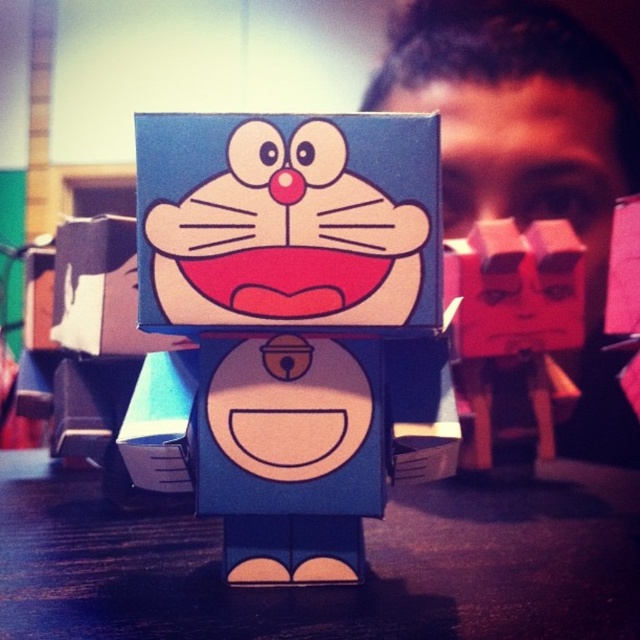
Who is more distant from viewer, (x=545, y=4) or (x=509, y=172)?

Point (x=545, y=4)

Is matte plastic man at center shorter than matte pink cube at center?

No.

This screenshot has height=640, width=640. Identify the location of matte plastic man at center. (529, 156).

Does blue cardboard table at center have a lesser height compared to matte pink cube at right?

Yes, blue cardboard table at center is shorter than matte pink cube at right.

Is blue cardboard table at center smaller than matte pink cube at right?

No.

Find the location of a particular element. blue cardboard table at center is located at coordinates (330, 586).

Who is positioned more to the right, blue cardboard table at center or matte pink cube at center?

Positioned to the right is matte pink cube at center.

Can you confirm if blue cardboard table at center is positioned to the right of matte pink cube at center?

No, blue cardboard table at center is not to the right of matte pink cube at center.

Is point (168, 552) in front of point (538, 118)?

Yes, it is.

Find the location of a particular element. Image resolution: width=640 pixels, height=640 pixels. blue cardboard table at center is located at coordinates (330, 586).